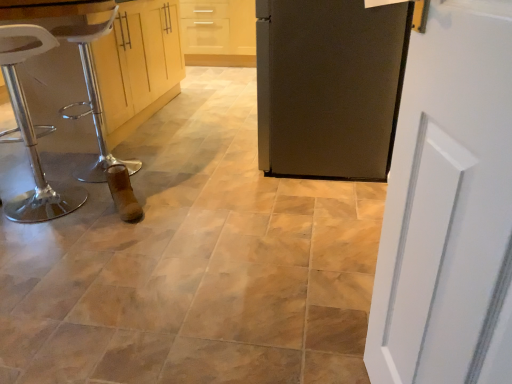
Locate an element on the screen. The image size is (512, 384). free space behind white plastic bar stool at left is located at coordinates (138, 147).